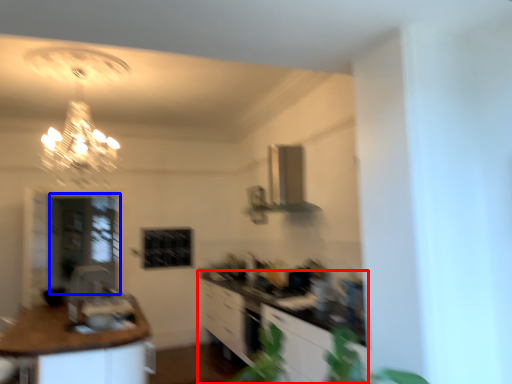
Question: Which object is further to the camera taking this photo, cabinetry (highlighted by a red box) or glass door (highlighted by a blue box)?

Choices:
 (A) cabinetry
 (B) glass door

Answer: (B)